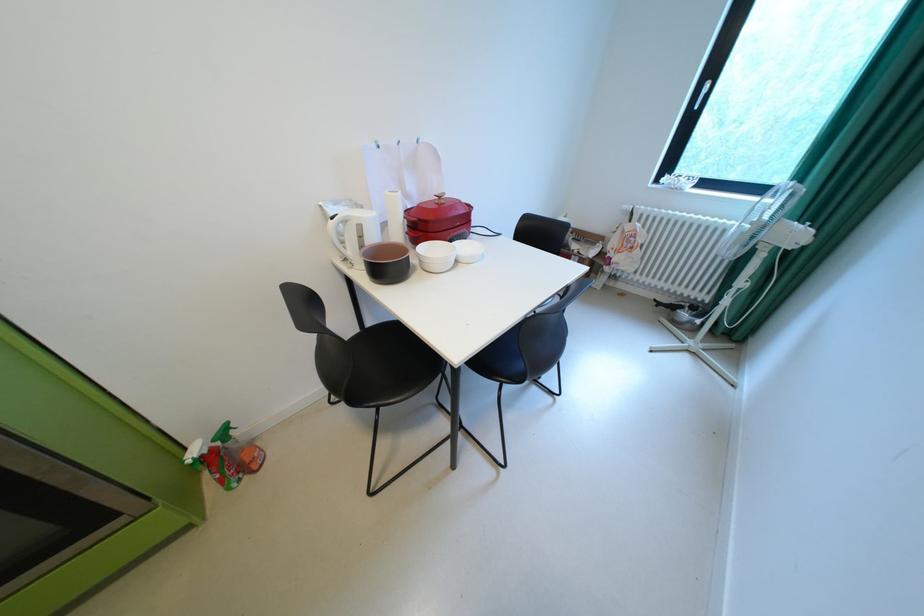
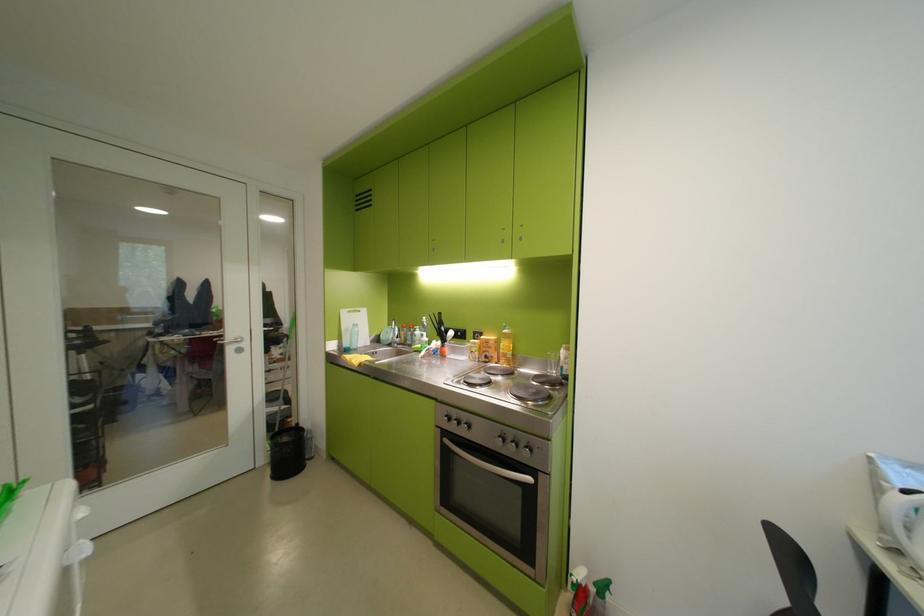
Find the pixel in the second image that matches point 200,463 in the first image.

(585, 581)